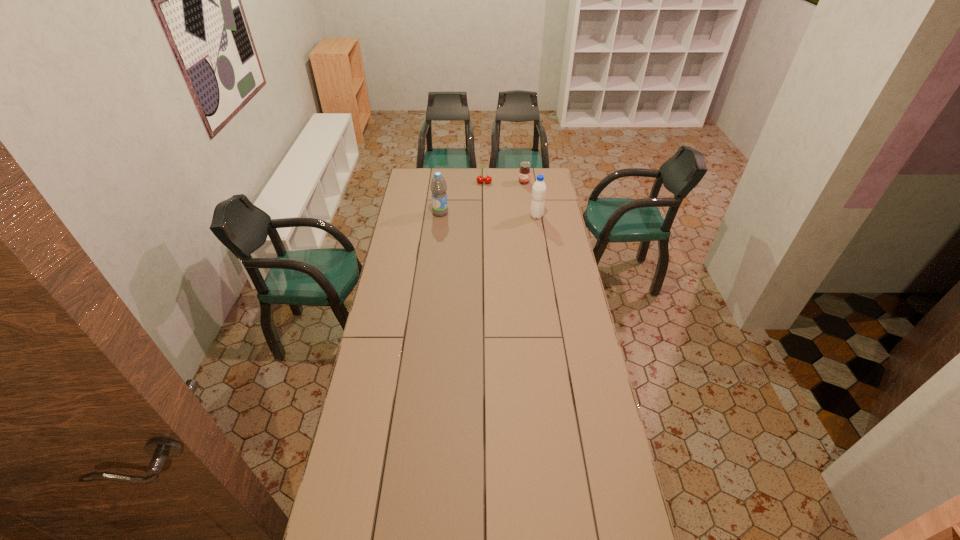
At what (x,y) coordinates should I click in order to perform the action: click on vacant space at the right edge. Please return your answer as a coordinate pair (x, y). The height and width of the screenshot is (540, 960). Looking at the image, I should click on (560, 253).

I want to click on vacant area at the near left corner of the desktop, so click(x=379, y=527).

Locate an element on the screen. Image resolution: width=960 pixels, height=540 pixels. vacant space at the far right corner of the desktop is located at coordinates (544, 170).

In the image, there is a desktop. Where is `free space at the near right corner`? Image resolution: width=960 pixels, height=540 pixels. free space at the near right corner is located at coordinates (589, 511).

Find the location of a particular element. The width and height of the screenshot is (960, 540). unoccupied position between the cherry and the jam is located at coordinates (504, 183).

Identify the location of free space between the right water bottle and the second object from left to right. (511, 199).

Identify the location of vacant region between the third object from right to left and the jam. This screenshot has height=540, width=960. (504, 183).

At what (x,y) coordinates should I click in order to perform the action: click on free spot between the jam and the right water bottle. Please return your answer as a coordinate pair (x, y). The width and height of the screenshot is (960, 540). Looking at the image, I should click on (530, 199).

At what (x,y) coordinates should I click in order to perform the action: click on free spot between the right water bottle and the jam. Please return your answer as a coordinate pair (x, y). Looking at the image, I should click on (530, 199).

Where is `vacant area that lies between the left water bottle and the cherry`? Image resolution: width=960 pixels, height=540 pixels. vacant area that lies between the left water bottle and the cherry is located at coordinates (463, 198).